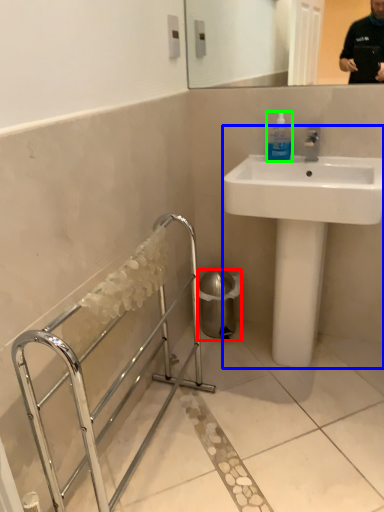
Question: Considering the real-world distances, which object is closest to trash bin/can (highlighted by a red box)? sink (highlighted by a blue box) or mouthwash (highlighted by a green box).

Choices:
 (A) sink
 (B) mouthwash

Answer: (A)